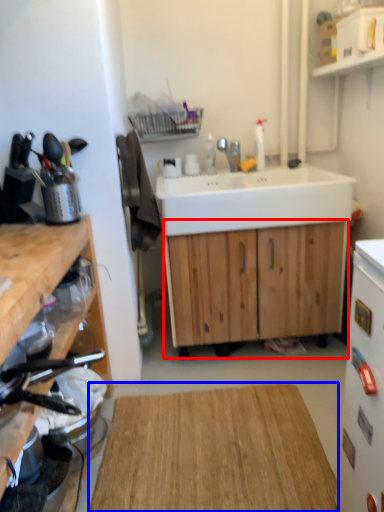
Question: Which of the following is the farthest to the observer, cabinetry (highlighted by a red box) or hardwood (highlighted by a blue box)?

Choices:
 (A) cabinetry
 (B) hardwood

Answer: (A)